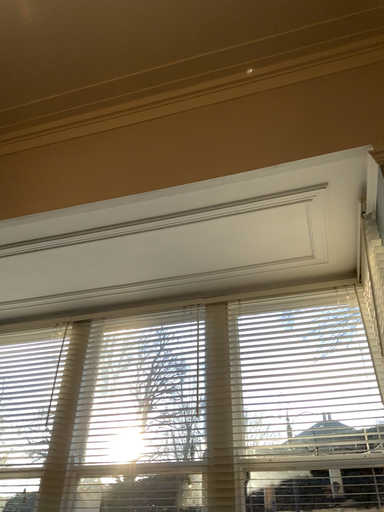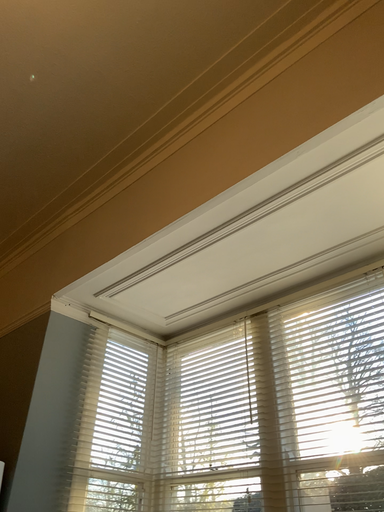
Question: Which way did the camera rotate in the video?

Choices:
 (A) rotated left
 (B) rotated right

Answer: (A)